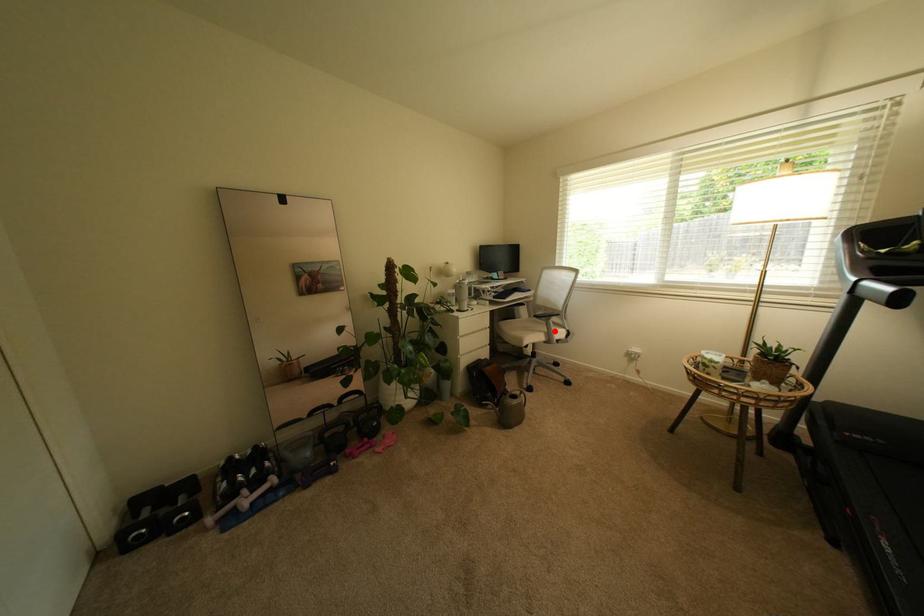
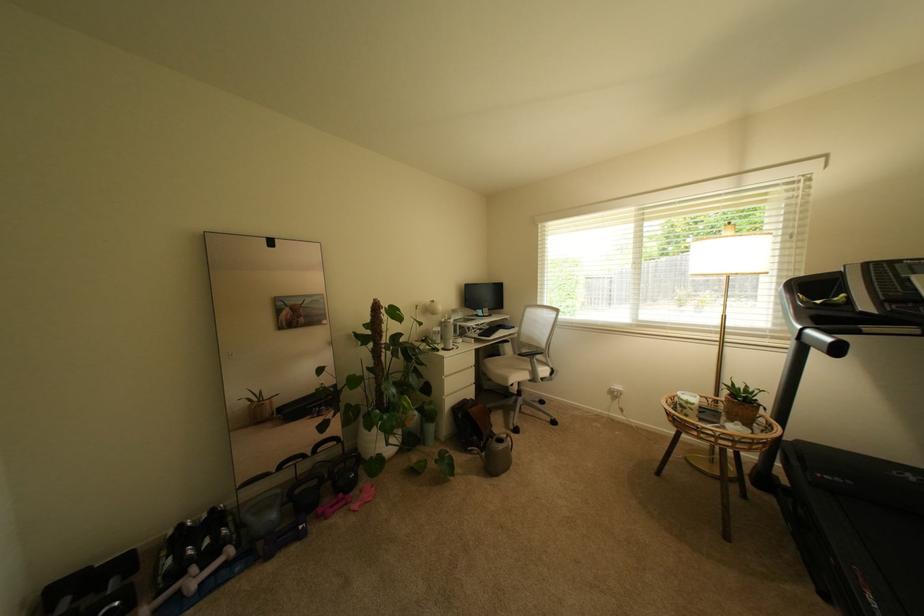
Question: I am providing you with two images of the same scene from different viewpoints. A red point is shown in image1. For the corresponding object point in image2, is it positioned nearer or farther from the camera?

Choices:
 (A) Nearer
 (B) Farther

Answer: (B)